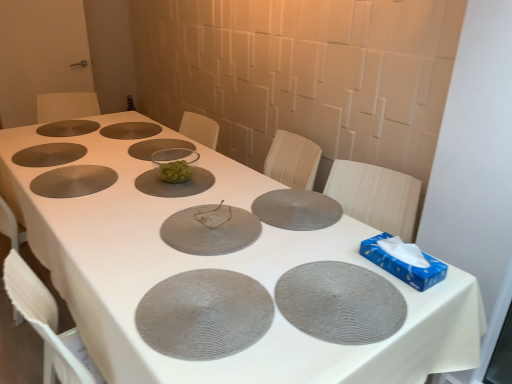
What are the coordinates of `vacant space that is in between matte gray plate at upper left, positioned as the fourth glass plate in back-to-front order, and green glass bowl at center` in the screenshot? It's located at (93, 165).